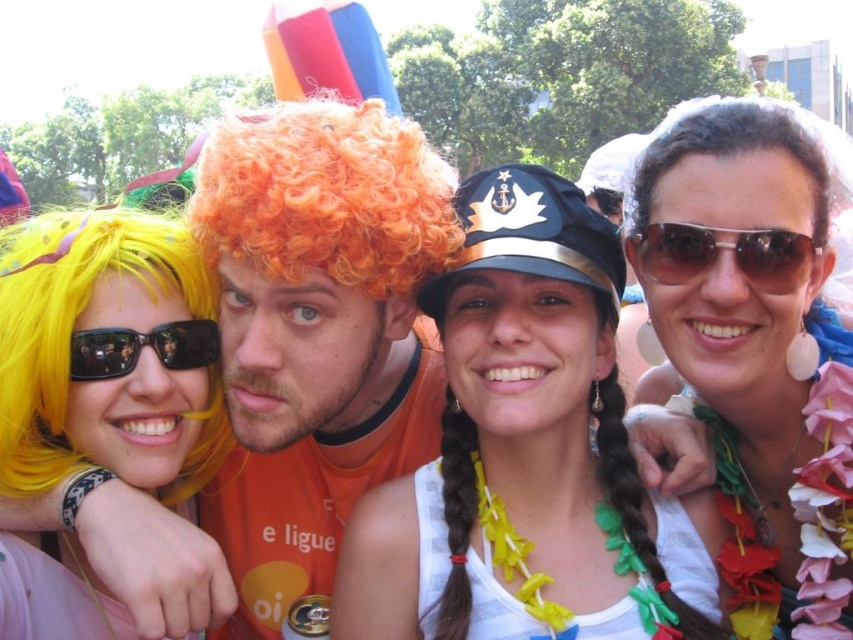
Can you confirm if shiny yellow wig at left is bigger than black reflective sunglasses at upper left?

No.

Is shiny yellow wig at left behind black reflective sunglasses at upper left?

Yes, shiny yellow wig at left is behind black reflective sunglasses at upper left.

Does point (80, 467) come closer to viewer compared to point (178, 369)?

Yes, point (80, 467) is in front of point (178, 369).

At what (x,y) coordinates should I click in order to perform the action: click on shiny yellow wig at left. Please return your answer as a coordinate pair (x, y). The image size is (853, 640). Looking at the image, I should click on (107, 355).

Between point (190, 484) and point (741, 131), which one is positioned behind?

The point (190, 484) is behind.

Which of these two, shiny yellow wig at left or brown curly wig at upper right, stands shorter?

Standing shorter between the two is shiny yellow wig at left.

Describe the element at coordinates (107, 355) in the screenshot. I see `shiny yellow wig at left` at that location.

The width and height of the screenshot is (853, 640). I want to click on shiny yellow wig at left, so click(107, 355).

Can you confirm if pearl necklace at upper right is thinner than orange curly wig at center?

Yes.

From the picture: Which is more to the right, pearl necklace at upper right or orange curly wig at center?

pearl necklace at upper right is more to the right.

What do you see at coordinates (757, 344) in the screenshot? The height and width of the screenshot is (640, 853). I see `pearl necklace at upper right` at bounding box center [757, 344].

At what (x,y) coordinates should I click in order to perform the action: click on pearl necklace at upper right. Please return your answer as a coordinate pair (x, y). Looking at the image, I should click on (757, 344).